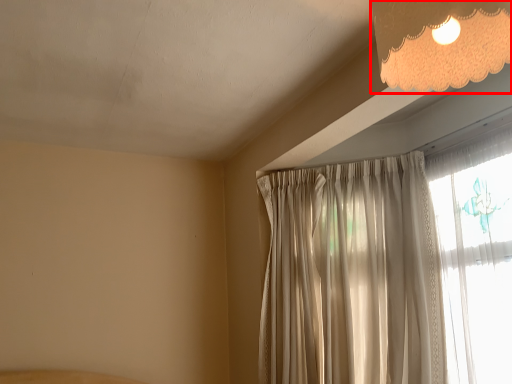
Question: Where is lamp (annotated by the red box) located in relation to curtain in the image?

Choices:
 (A) left
 (B) right

Answer: (B)